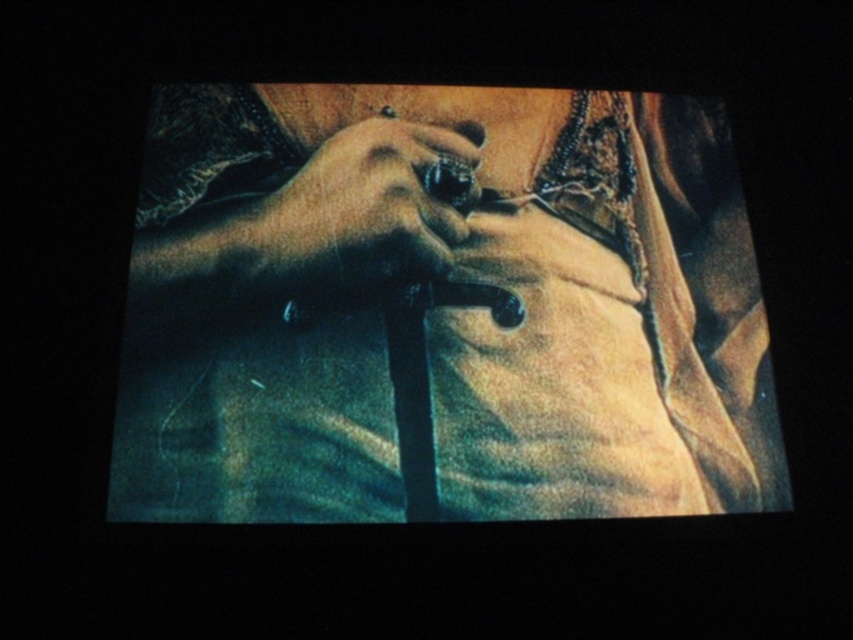
You are a photographer trying to capture the matte black cane at center in a close up shot. The camera is positioned at point 0.5,0.5. Will the cane be in focus if the camera is focused at point 0.5,0.5?

The matte black cane at center is located at point (440, 307). Since the camera is focused at (426, 320), the distance between the focus point and the cane is minimal, so the cane will likely be in focus.

You are a costume designer preparing for a play. You need to decide whether the matte black cane at center can be stored inside the smooth leather glove at center. Based on the scene, can it fit?

The matte black cane at center is larger in size than the smooth leather glove at center, so it cannot fit inside the glove.